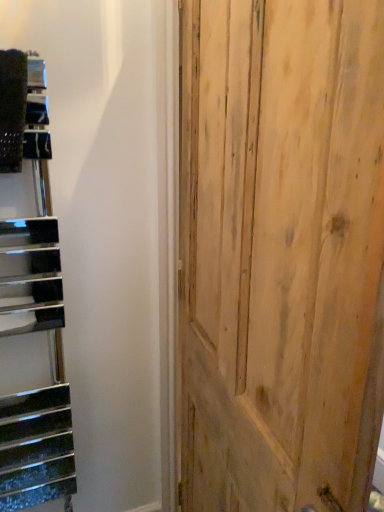
Locate an element on the screen. natural wood door at center is located at coordinates (281, 253).

The width and height of the screenshot is (384, 512). What do you see at coordinates (281, 253) in the screenshot?
I see `natural wood door at center` at bounding box center [281, 253].

Image resolution: width=384 pixels, height=512 pixels. What do you see at coordinates (33, 323) in the screenshot? I see `metallic black stairwell at left` at bounding box center [33, 323].

You are a GUI agent. You are given a task and a screenshot of the screen. Output one action in this format:
    pyautogui.click(x=<x>, y=<y>)
    Task: Click on the metallic black stairwell at left
    This screenshot has width=384, height=512.
    Given the screenshot: What is the action you would take?
    pyautogui.click(x=33, y=323)

What are the coordinates of `natural wood door at center` in the screenshot? It's located at (281, 253).

Which object is positioned more to the right, metallic black stairwell at left or natural wood door at center?

From the viewer's perspective, natural wood door at center appears more on the right side.

Is the position of metallic black stairwell at left more distant than that of natural wood door at center?

Yes, the depth of metallic black stairwell at left is greater than that of natural wood door at center.

Does point (8, 58) come farther from viewer compared to point (346, 278)?

Yes, point (8, 58) is farther from viewer.

In the scene shown: From the image's perspective, does metallic black stairwell at left appear lower than natural wood door at center?

Actually, metallic black stairwell at left appears above natural wood door at center in the image.

From a real-world perspective, who is located higher, metallic black stairwell at left or natural wood door at center?

metallic black stairwell at left, from a real-world perspective.

Considering the sizes of metallic black stairwell at left and natural wood door at center in the image, is metallic black stairwell at left wider or thinner than natural wood door at center?

Clearly, metallic black stairwell at left has less width compared to natural wood door at center.

From the picture: Considering the relative sizes of metallic black stairwell at left and natural wood door at center in the image provided, is metallic black stairwell at left shorter than natural wood door at center?

Indeed, metallic black stairwell at left has a lesser height compared to natural wood door at center.

Considering the sizes of objects metallic black stairwell at left and natural wood door at center in the image provided, who is bigger, metallic black stairwell at left or natural wood door at center?

natural wood door at center is bigger.

Is natural wood door at center completely or partially inside metallic black stairwell at left?

No, natural wood door at center is not inside metallic black stairwell at left.

Are metallic black stairwell at left and natural wood door at center far apart?

They are positioned close to each other.

Is metallic black stairwell at left turned away from natural wood door at center?

metallic black stairwell at left is not turned away from natural wood door at center.

Measure the distance between metallic black stairwell at left and natural wood door at center.

metallic black stairwell at left and natural wood door at center are 22.25 inches apart from each other.

Find the location of a particular element. This screenshot has height=512, width=384. door located underneath the metallic black stairwell at left (from a real-world perspective) is located at coordinates (281, 253).

From the picture: Does natural wood door at center appear on the left side of metallic black stairwell at left?

No, natural wood door at center is not to the left of metallic black stairwell at left.

Between natural wood door at center and metallic black stairwell at left, which one is positioned in front?

natural wood door at center is in front.

Is point (369, 75) closer or farther from the camera than point (27, 314)?

Point (369, 75).

From the image's perspective, is natural wood door at center over metallic black stairwell at left?

No, from the image's perspective, natural wood door at center is not over metallic black stairwell at left.

From a real-world perspective, relative to metallic black stairwell at left, is natural wood door at center vertically above or below?

Clearly, from a real-world perspective, natural wood door at center is below metallic black stairwell at left.

Based on the photo, is natural wood door at center thinner than metallic black stairwell at left?

In fact, natural wood door at center might be wider than metallic black stairwell at left.

Between natural wood door at center and metallic black stairwell at left, which one has more height?

Standing taller between the two is natural wood door at center.

Considering the relative sizes of natural wood door at center and metallic black stairwell at left in the image provided, is natural wood door at center bigger than metallic black stairwell at left?

Yes.

Is natural wood door at center positioned beyond the bounds of metallic black stairwell at left?

natural wood door at center lies outside metallic black stairwell at left's area.

Is natural wood door at center in contact with metallic black stairwell at left?

No, natural wood door at center is not beside metallic black stairwell at left.

Is natural wood door at center oriented away from metallic black stairwell at left?

That's not correct — natural wood door at center is not looking away from metallic black stairwell at left.

You are a GUI agent. You are given a task and a screenshot of the screen. Output one action in this format:
    pyautogui.click(x=<x>, y=<y>)
    Task: Click on the stairwell above the natural wood door at center (from the image's perspective)
    The height and width of the screenshot is (512, 384).
    Given the screenshot: What is the action you would take?
    pyautogui.click(x=33, y=323)

Locate an element on the screen. The width and height of the screenshot is (384, 512). door located in front of the metallic black stairwell at left is located at coordinates (281, 253).

At what (x,y) coordinates should I click in order to perform the action: click on stairwell on the left of natural wood door at center. Please return your answer as a coordinate pair (x, y). Looking at the image, I should click on (33, 323).